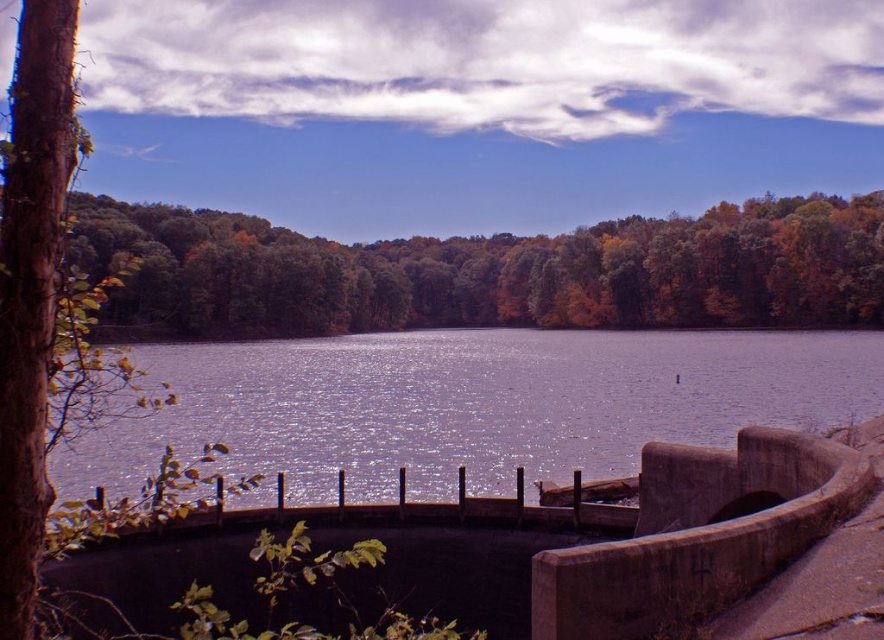
In the scene shown: Does glistening water at center appear over green leafy trees at center?

Actually, glistening water at center is below green leafy trees at center.

Which is above, glistening water at center or green leafy trees at center?

green leafy trees at center

Does point (726, 432) come closer to viewer compared to point (311, 308)?

That is True.

You are a GUI agent. You are given a task and a screenshot of the screen. Output one action in this format:
    pyautogui.click(x=<x>, y=<y>)
    Task: Click on the glistening water at center
    The image size is (884, 640).
    Given the screenshot: What is the action you would take?
    pyautogui.click(x=471, y=404)

Is concrete dam at lower center taller than green leafy trees at center?

In fact, concrete dam at lower center may be shorter than green leafy trees at center.

Which is more to the right, concrete dam at lower center or green leafy trees at center?

green leafy trees at center is more to the right.

The image size is (884, 640). What are the coordinates of `concrete dam at lower center` in the screenshot? It's located at (482, 554).

Is concrete dam at lower center positioned behind glistening water at center?

No.

Does concrete dam at lower center have a lesser height compared to glistening water at center?

Incorrect, concrete dam at lower center's height does not fall short of glistening water at center's.

Find the location of `concrete dam at lower center`. concrete dam at lower center is located at coordinates (482, 554).